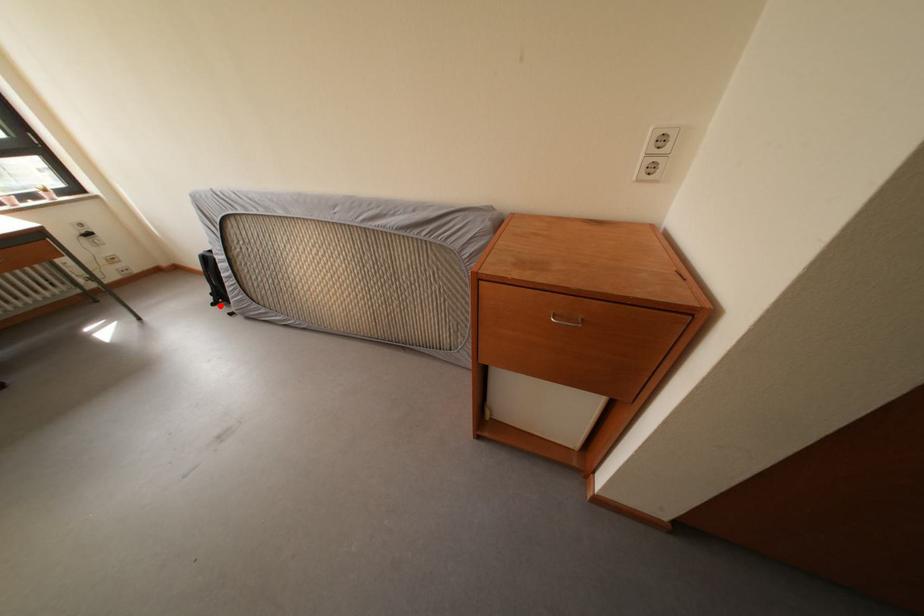
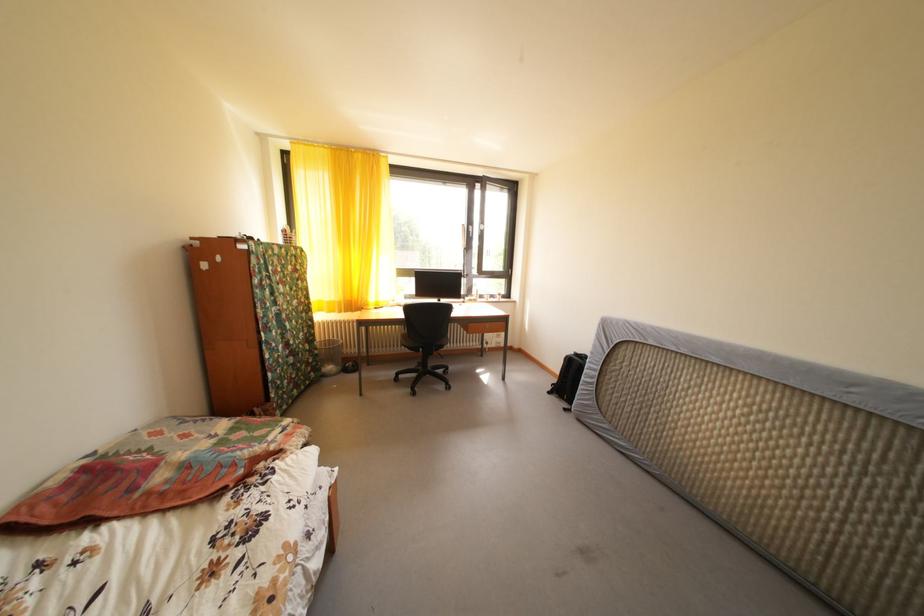
Locate, in the second image, the point that corresponds to the highlighted location in the first image.

(558, 394)